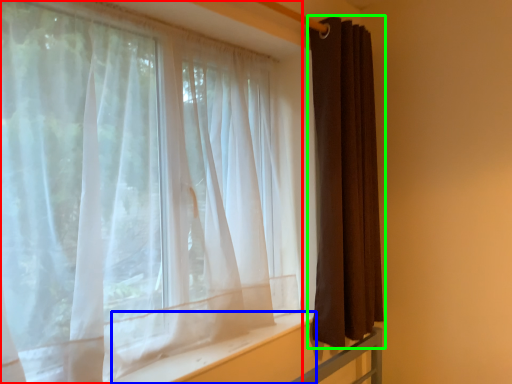
Question: Which object is the closest to the curtain (highlighted by a red box)? Choose among these: window sill (highlighted by a blue box) or curtain (highlighted by a green box).

Choices:
 (A) window sill
 (B) curtain

Answer: (A)